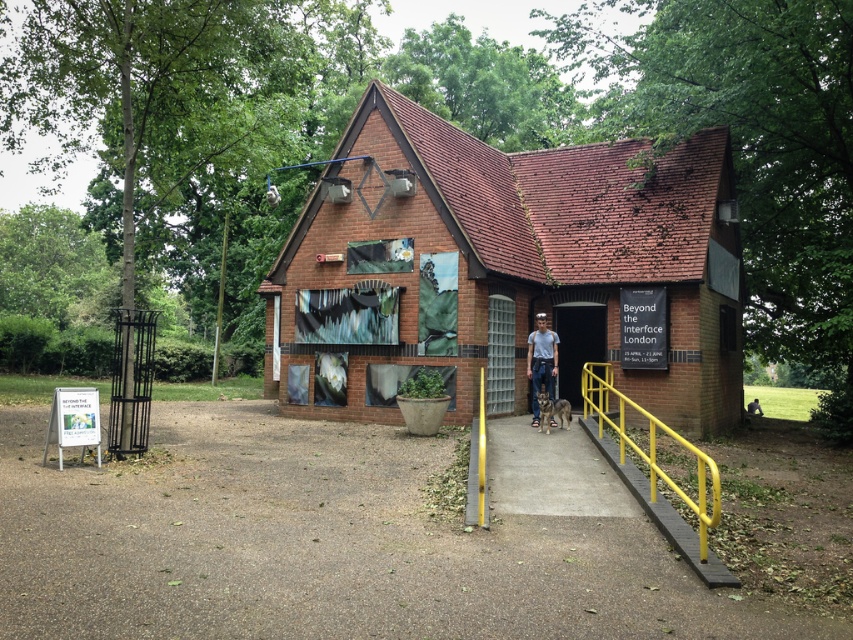
Question: Observing the image, what is the correct spatial positioning of brick building at center in reference to yellow metal handrail at lower center?

Choices:
 (A) below
 (B) above

Answer: (B)

Question: Which point is closer to the camera?

Choices:
 (A) (682, 493)
 (B) (567, 317)
 (C) (682, 268)
 (D) (537, 332)

Answer: (A)

Question: Is yellow metal handrail at lower center smaller than matte glass door at center?

Choices:
 (A) no
 (B) yes

Answer: (A)

Question: Which object is the farthest from the yellow metal handrail at lower center?

Choices:
 (A) light blue denim jeans at center
 (B) matte glass door at center

Answer: (B)

Question: Is brick building at center bigger than yellow metal handrail at lower center?

Choices:
 (A) yes
 (B) no

Answer: (A)

Question: Which object is farther from the camera taking this photo?

Choices:
 (A) yellow metal handrail at lower center
 (B) matte glass door at center
 (C) light blue denim jeans at center
 (D) brick building at center

Answer: (B)